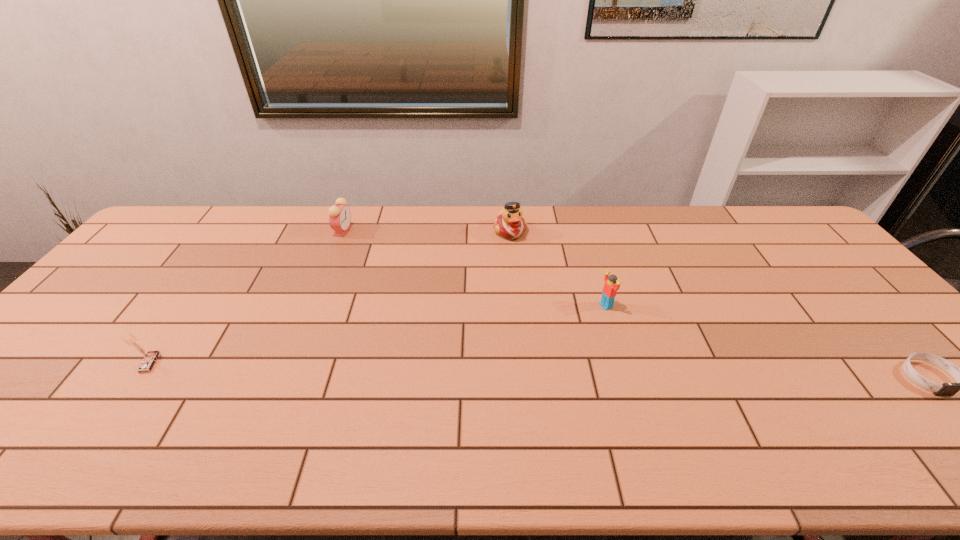
Locate an element on the screen. vacant space located on the face of the fourth object from right to left is located at coordinates (371, 261).

Where is `vacant space located on the face of the fourth object from right to left`? Image resolution: width=960 pixels, height=540 pixels. vacant space located on the face of the fourth object from right to left is located at coordinates [x=392, y=282].

Locate an element on the screen. blank area located 0.290m on the face of the duck is located at coordinates (552, 300).

Locate an element on the screen. vacant space located 0.120m on the face of the duck is located at coordinates (530, 264).

Identify the location of free region located on the face of the duck. The height and width of the screenshot is (540, 960). point(535,272).

Where is `alarm clock at the far edge`? This screenshot has width=960, height=540. alarm clock at the far edge is located at coordinates point(339,214).

At what (x,y) coordinates should I click in order to perform the action: click on duck present at the far edge. Please return your answer as a coordinate pair (x, y). Image resolution: width=960 pixels, height=540 pixels. Looking at the image, I should click on (510, 224).

Identify the location of vacant space at the far edge of the desktop. (456, 230).

Identify the location of vacant area at the near edge. (91, 417).

The image size is (960, 540). I want to click on vacant position at the left edge of the desktop, so click(148, 260).